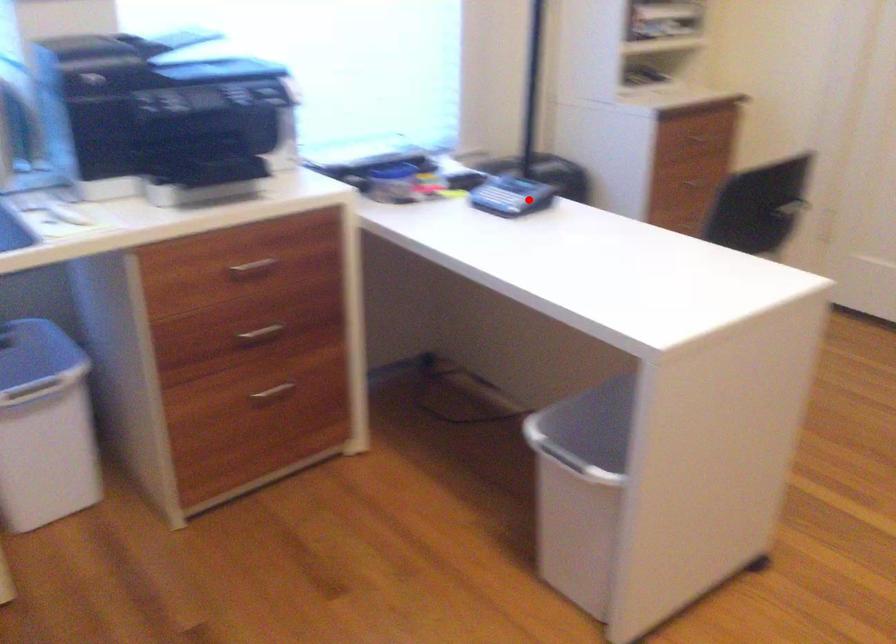
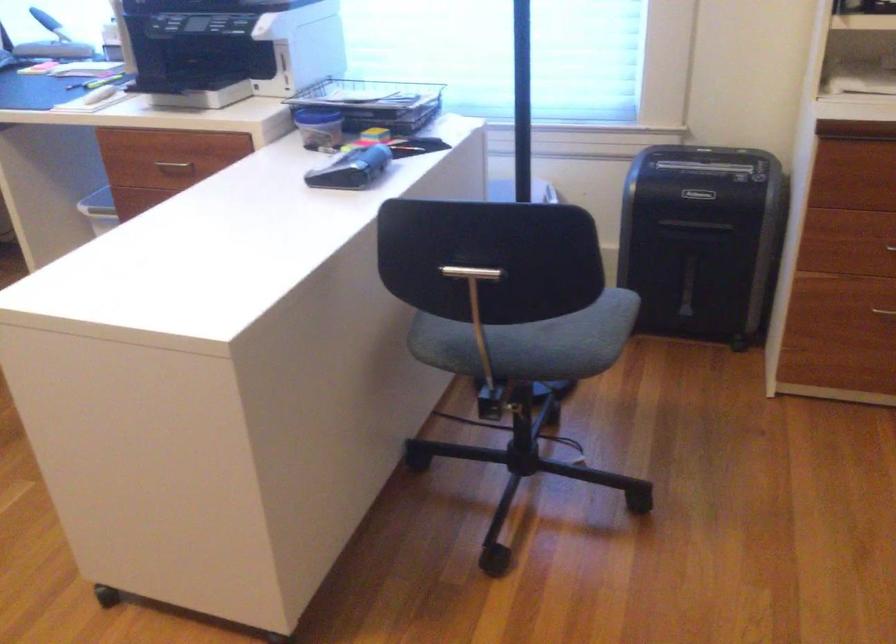
The point at the highlighted location is marked in the first image. Where is the corresponding point in the second image?

(351, 169)